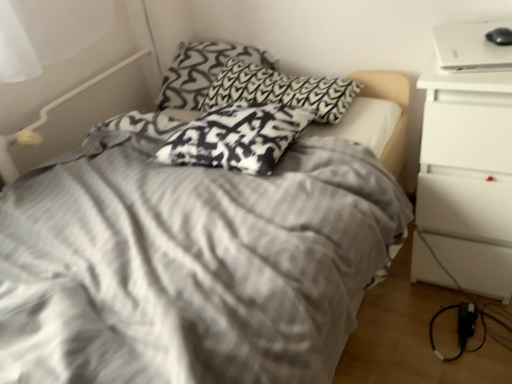
Identify the location of free space above white matte nightstand at right (from a real-world perspective). (480, 47).